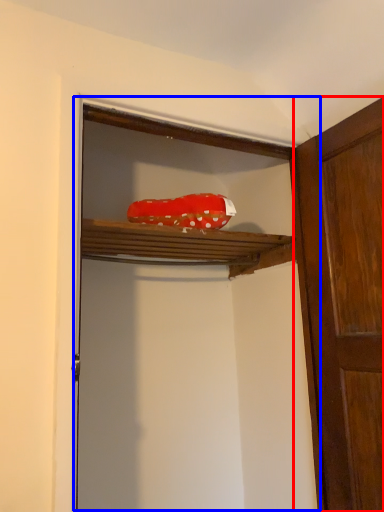
Question: Among these objects, which one is nearest to the camera, door (highlighted by a red box) or cabinetry (highlighted by a blue box)?

Choices:
 (A) door
 (B) cabinetry

Answer: (B)